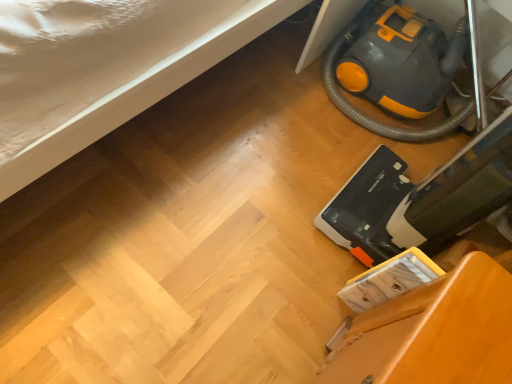
Where is `free space in front of yellow-orange plastic vacuum cleaner at lower right, the first equipment viewed from the front`? The image size is (512, 384). free space in front of yellow-orange plastic vacuum cleaner at lower right, the first equipment viewed from the front is located at coordinates (302, 292).